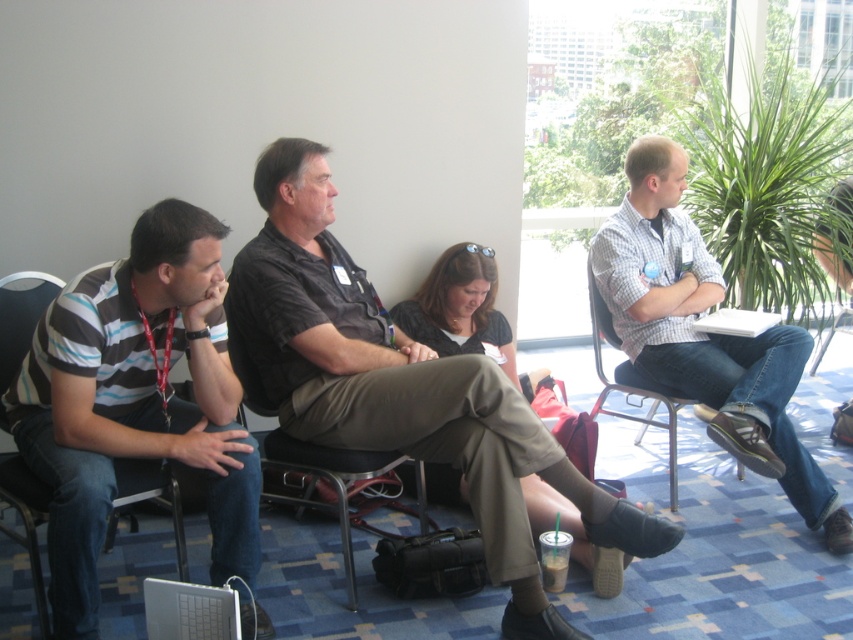
Can you confirm if checkered shirt at right is thinner than white matte laptop at right?

No, checkered shirt at right is not thinner than white matte laptop at right.

This screenshot has width=853, height=640. I want to click on checkered shirt at right, so click(705, 333).

Who is positioned more to the right, dark brown shirt at center or checkered shirt at right?

From the viewer's perspective, checkered shirt at right appears more on the right side.

Who is higher up, dark brown shirt at center or checkered shirt at right?

checkered shirt at right is higher up.

Locate an element on the screen. The height and width of the screenshot is (640, 853). dark brown shirt at center is located at coordinates (401, 387).

Is striped cotton shirt at left taller than white matte laptop at right?

Indeed, striped cotton shirt at left has a greater height compared to white matte laptop at right.

Is the position of striped cotton shirt at left more distant than that of white matte laptop at right?

No, striped cotton shirt at left is in front of white matte laptop at right.

Who is more forward, (254, 538) or (717, 317)?

Point (254, 538)

This screenshot has width=853, height=640. I want to click on striped cotton shirt at left, so click(135, 401).